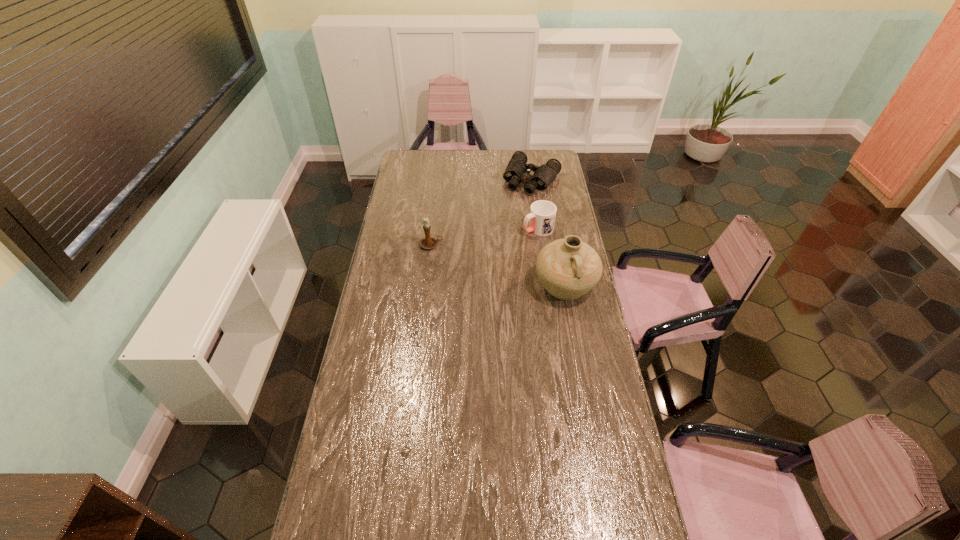
You are a GUI agent. You are given a task and a screenshot of the screen. Output one action in this format:
    pyautogui.click(x=<x>, y=<y>)
    Task: Click on the free space on the desktop that is between the candle holder and the tallest object and is positioned through the eyepieces of the farthest object
    
    Given the screenshot: What is the action you would take?
    pyautogui.click(x=481, y=260)

This screenshot has height=540, width=960. Find the location of `vacant spot on the desktop that is between the second nearest object and the nearest object and is positioned on the side of the third nearest object with the handle`. vacant spot on the desktop that is between the second nearest object and the nearest object and is positioned on the side of the third nearest object with the handle is located at coordinates (475, 259).